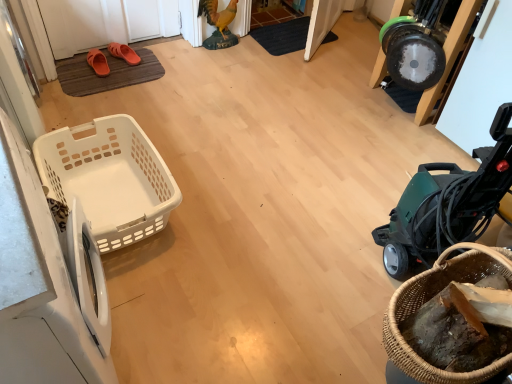
Question: Considering their positions, is white plastic washing machine at left, which appears as the second washing machine when viewed from the left, located in front of or behind orange rubber sandals at upper left, the first footwear from the right?

Choices:
 (A) front
 (B) behind

Answer: (A)

Question: Is white plastic washing machine at left, which appears as the second washing machine when viewed from the left, wider or thinner than orange rubber sandals at upper left, acting as the 2th footwear starting from the left?

Choices:
 (A) wide
 (B) thin

Answer: (B)

Question: Which of these objects is positioned farthest from the black textured doormat at center, arranged as the second doormat when viewed from the left?

Choices:
 (A) green plastic vacuum cleaner at right
 (B) white plastic washing machine at left, which appears as the second washing machine when viewed from the left
 (C) woven brown basket at lower right, marked as the second basket in a left-to-right arrangement
 (D) brown rubber doormat at upper left, positioned as the first doormat in front-to-back order
 (E) white plastic washing machine at left, marked as the second washing machine in a right-to-left arrangement

Answer: (E)

Question: Estimate the real-world distances between objects in this image. Which object is closer to the white plastic washing machine at left, marked as the second washing machine in a right-to-left arrangement?

Choices:
 (A) white plastic washing machine at left, which is the first washing machine in right-to-left order
 (B) black textured doormat at center, acting as the 1th doormat starting from the right
 (C) orange rubber sandals at upper left, acting as the 2th footwear starting from the left
 (D) brown rubber doormat at upper left, positioned as the 2th doormat in top-to-bottom order
 (E) white plastic basket at left, which is the second basket in front-to-back order

Answer: (A)